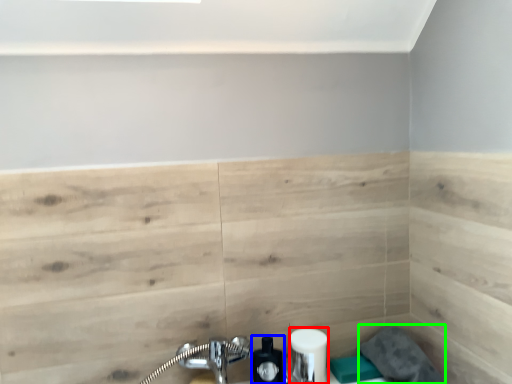
Question: Based on their relative distances, which object is nearer to toiletry (highlighted by a red box)? Choose from soap dispenser (highlighted by a blue box) and gray (highlighted by a green box).

Choices:
 (A) soap dispenser
 (B) gray

Answer: (A)